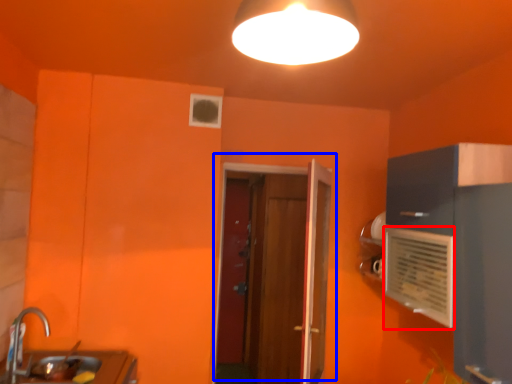
Question: Which point is closer to the camera, air conditioning (highlighted by a red box) or door (highlighted by a blue box)?

Choices:
 (A) air conditioning
 (B) door

Answer: (A)